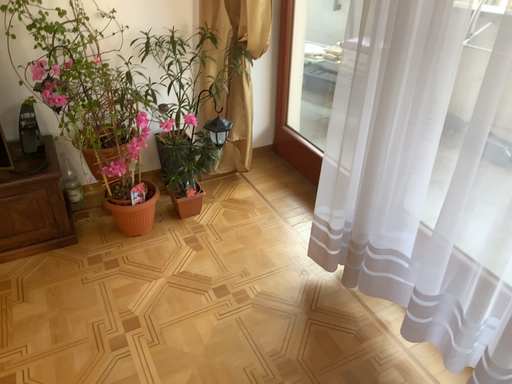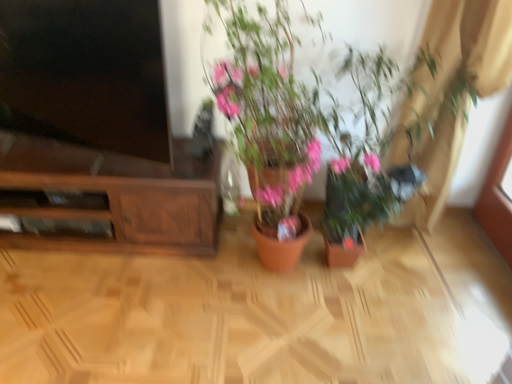
Question: Which way did the camera rotate in the video?

Choices:
 (A) rotated right
 (B) rotated left

Answer: (B)